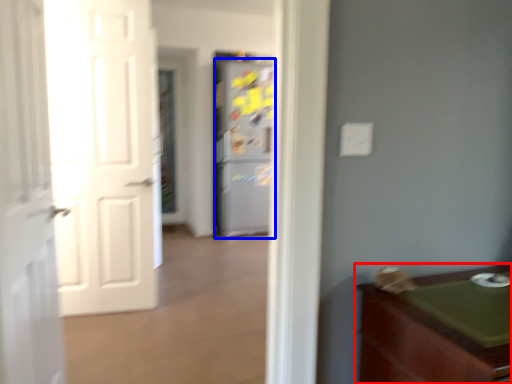
Question: Which of the following is the farthest to the observer, cabinetry (highlighted by a red box) or refrigerator (highlighted by a blue box)?

Choices:
 (A) cabinetry
 (B) refrigerator

Answer: (B)